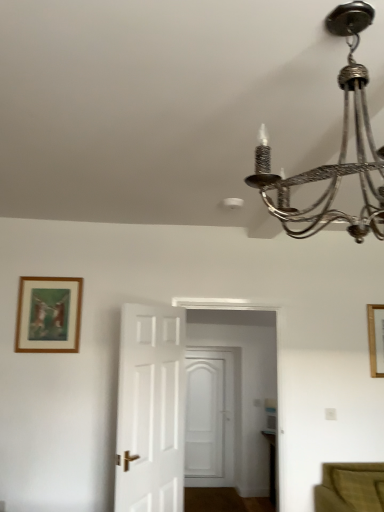
Question: Should I look upward or downward to see white wooden door at center, which appears as the 2th door when viewed from the left?

Choices:
 (A) down
 (B) up

Answer: (A)

Question: Does wooden picture frame at upper right, which is counted as the second picture frame, starting from the left, have a greater height compared to metallic chandelier at upper right?

Choices:
 (A) yes
 (B) no

Answer: (B)

Question: Does wooden picture frame at upper right, which ranks as the 1th picture frame in right-to-left order, have a greater width compared to metallic chandelier at upper right?

Choices:
 (A) yes
 (B) no

Answer: (B)

Question: Is the depth of wooden picture frame at upper right, which is counted as the second picture frame, starting from the left, greater than that of metallic chandelier at upper right?

Choices:
 (A) no
 (B) yes

Answer: (B)

Question: Does wooden picture frame at upper right, which ranks as the 1th picture frame in back-to-front order, have a larger size compared to metallic chandelier at upper right?

Choices:
 (A) yes
 (B) no

Answer: (B)

Question: Is wooden picture frame at upper right, which ranks as the 1th picture frame in right-to-left order, at the right side of metallic chandelier at upper right?

Choices:
 (A) no
 (B) yes

Answer: (B)

Question: From a real-world perspective, is wooden picture frame at upper right, which ranks as the 1th picture frame in back-to-front order, physically above metallic chandelier at upper right?

Choices:
 (A) no
 (B) yes

Answer: (A)

Question: Does white wooden door at center, marked as the 2th door in a front-to-back arrangement, have a lesser height compared to white wooden door at center, the second door from the right?

Choices:
 (A) no
 (B) yes

Answer: (A)

Question: Considering the relative sizes of white wooden door at center, marked as the 2th door in a front-to-back arrangement, and white wooden door at center, the second door from the right, in the image provided, is white wooden door at center, marked as the 2th door in a front-to-back arrangement, wider than white wooden door at center, the second door from the right,?

Choices:
 (A) yes
 (B) no

Answer: (B)

Question: Is white wooden door at center, marked as the 1th door in a back-to-front arrangement, further to camera compared to white wooden door at center, which is the first door in left-to-right order?

Choices:
 (A) yes
 (B) no

Answer: (A)

Question: Is white wooden door at center, which appears as the 2th door when viewed from the left, looking in the opposite direction of white wooden door at center, which appears as the first door when viewed from the front?

Choices:
 (A) yes
 (B) no

Answer: (B)

Question: From the image's perspective, would you say white wooden door at center, the first door when ordered from right to left, is shown under white wooden door at center, which appears as the first door when viewed from the front?

Choices:
 (A) yes
 (B) no

Answer: (A)

Question: Does white wooden door at center, marked as the 1th door in a back-to-front arrangement, have a larger size compared to white wooden door at center, the 2th door in the back-to-front sequence?

Choices:
 (A) no
 (B) yes

Answer: (A)

Question: Is metallic chandelier at upper right positioned in front of white wooden door at center, which appears as the 2th door when viewed from the left?

Choices:
 (A) yes
 (B) no

Answer: (A)